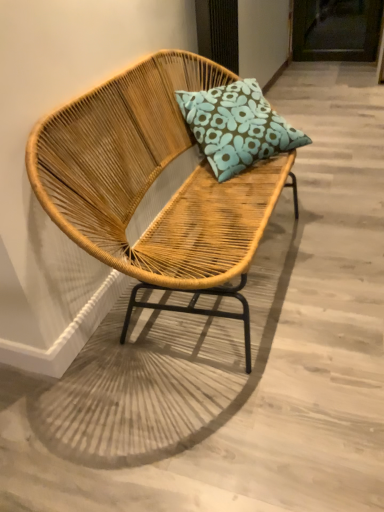
Question: In the image, is bamboo woven chair at center positioned in front of or behind blue floral cushion at center?

Choices:
 (A) behind
 (B) front

Answer: (B)

Question: From a real-world perspective, relative to blue floral cushion at center, is bamboo woven chair at center vertically above or below?

Choices:
 (A) below
 (B) above

Answer: (A)

Question: From the image's perspective, relative to blue floral cushion at center, is bamboo woven chair at center above or below?

Choices:
 (A) below
 (B) above

Answer: (A)

Question: Is blue floral cushion at center situated inside bamboo woven chair at center or outside?

Choices:
 (A) outside
 (B) inside

Answer: (B)

Question: Considering their positions, is blue floral cushion at center located in front of or behind bamboo woven chair at center?

Choices:
 (A) behind
 (B) front

Answer: (A)

Question: From a real-world perspective, relative to bamboo woven chair at center, is blue floral cushion at center vertically above or below?

Choices:
 (A) above
 (B) below

Answer: (A)

Question: Visually, is blue floral cushion at center positioned to the left or to the right of bamboo woven chair at center?

Choices:
 (A) left
 (B) right

Answer: (B)